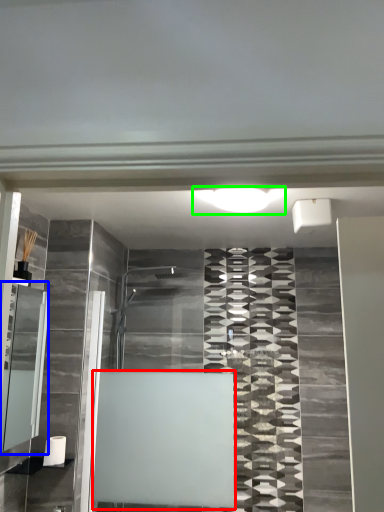
Question: Considering the real-world distances, which object is closest to bath (highlighted by a red box)? cabinet (highlighted by a blue box) or light (highlighted by a green box).

Choices:
 (A) cabinet
 (B) light

Answer: (A)